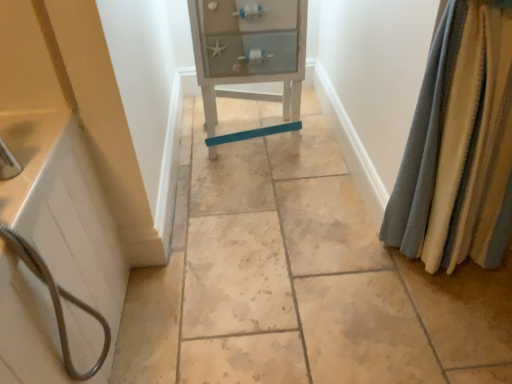
Image resolution: width=512 pixels, height=384 pixels. In order to click on white matte bathtub at left in this screenshot , I will do `click(64, 212)`.

What are the coordinates of `white wood cabinet at center` in the screenshot? It's located at (250, 58).

In the scene shown: Is there a large distance between white wood cabinet at center and velvet-like beige curtains at right?

white wood cabinet at center is near velvet-like beige curtains at right, not far away.

Consider the image. Who is bigger, white wood cabinet at center or velvet-like beige curtains at right?

white wood cabinet at center is bigger.

From a real-world perspective, is white wood cabinet at center above or below velvet-like beige curtains at right?

Clearly, from a real-world perspective, white wood cabinet at center is below velvet-like beige curtains at right.

Is white wood cabinet at center aimed at velvet-like beige curtains at right?

No, white wood cabinet at center is not facing towards velvet-like beige curtains at right.

Considering the positions of objects white wood cabinet at center and white matte bathtub at left in the image provided, who is more to the left, white wood cabinet at center or white matte bathtub at left?

From the viewer's perspective, white matte bathtub at left appears more on the left side.

From the image's perspective, does white wood cabinet at center appear higher than white matte bathtub at left?

Yes.

Find the location of a particular element. This screenshot has width=512, height=384. bath below the white wood cabinet at center (from the image's perspective) is located at coordinates point(64,212).

Which is behind, white wood cabinet at center or white matte bathtub at left?

white wood cabinet at center is further from the camera.

From their relative heights in the image, would you say velvet-like beige curtains at right is taller or shorter than white matte bathtub at left?

In the image, velvet-like beige curtains at right appears to be taller than white matte bathtub at left.

From a real-world perspective, is velvet-like beige curtains at right physically below white matte bathtub at left?

Yes, from a real-world perspective, velvet-like beige curtains at right is beneath white matte bathtub at left.

Which of these two, velvet-like beige curtains at right or white matte bathtub at left, is bigger?

With larger size is white matte bathtub at left.

What are the coordinates of `bath located above the velvet-like beige curtains at right (from a real-world perspective)` in the screenshot? It's located at (64, 212).

Between velvet-like beige curtains at right and white wood cabinet at center, which one has less height?

white wood cabinet at center.

From the picture: From a real-world perspective, is velvet-like beige curtains at right under white wood cabinet at center?

Incorrect, from a real-world perspective, velvet-like beige curtains at right is higher than white wood cabinet at center.

Could white wood cabinet at center be considered to be inside velvet-like beige curtains at right?

No, white wood cabinet at center is located outside of velvet-like beige curtains at right.

From the image's perspective, which is above, white matte bathtub at left or velvet-like beige curtains at right?

velvet-like beige curtains at right.

Based on the photo, between white matte bathtub at left and velvet-like beige curtains at right, which one has more height?

velvet-like beige curtains at right.

Which is behind, white matte bathtub at left or velvet-like beige curtains at right?

velvet-like beige curtains at right.

Which of these two, white matte bathtub at left or velvet-like beige curtains at right, is smaller?

velvet-like beige curtains at right is smaller.

Where is `furniture located above the white matte bathtub at left (from the image's perspective)`? furniture located above the white matte bathtub at left (from the image's perspective) is located at coordinates (250, 58).

Considering the sizes of white matte bathtub at left and white wood cabinet at center in the image, is white matte bathtub at left bigger or smaller than white wood cabinet at center?

white matte bathtub at left is smaller than white wood cabinet at center.

Which is more to the right, white matte bathtub at left or white wood cabinet at center?

From the viewer's perspective, white wood cabinet at center appears more on the right side.

From a real-world perspective, which object rests below the other?

white wood cabinet at center.

This screenshot has width=512, height=384. What are the coordinates of `curtain to the right of white wood cabinet at center` in the screenshot? It's located at (459, 146).

Find the location of a particular element. bath on the left of white wood cabinet at center is located at coordinates (64, 212).

When comparing their distances from white wood cabinet at center, does white matte bathtub at left or velvet-like beige curtains at right seem further?

white matte bathtub at left.

Looking at the image, which one is located closer to white wood cabinet at center, velvet-like beige curtains at right or white matte bathtub at left?

The object closer to white wood cabinet at center is velvet-like beige curtains at right.

When comparing their distances from white matte bathtub at left, does velvet-like beige curtains at right or white wood cabinet at center seem closer?

The object closer to white matte bathtub at left is white wood cabinet at center.

Based on their spatial positions, is white wood cabinet at center or white matte bathtub at left further from velvet-like beige curtains at right?

white matte bathtub at left is further to velvet-like beige curtains at right.

Considering their positions, is white matte bathtub at left positioned further to velvet-like beige curtains at right than white wood cabinet at center?

Among the two, white matte bathtub at left is located further to velvet-like beige curtains at right.

Which object lies further to the anchor point white matte bathtub at left, white wood cabinet at center or velvet-like beige curtains at right?

velvet-like beige curtains at right lies further to white matte bathtub at left than the other object.

Locate an element on the screen. The width and height of the screenshot is (512, 384). furniture located between white matte bathtub at left and velvet-like beige curtains at right in the left-right direction is located at coordinates (250, 58).